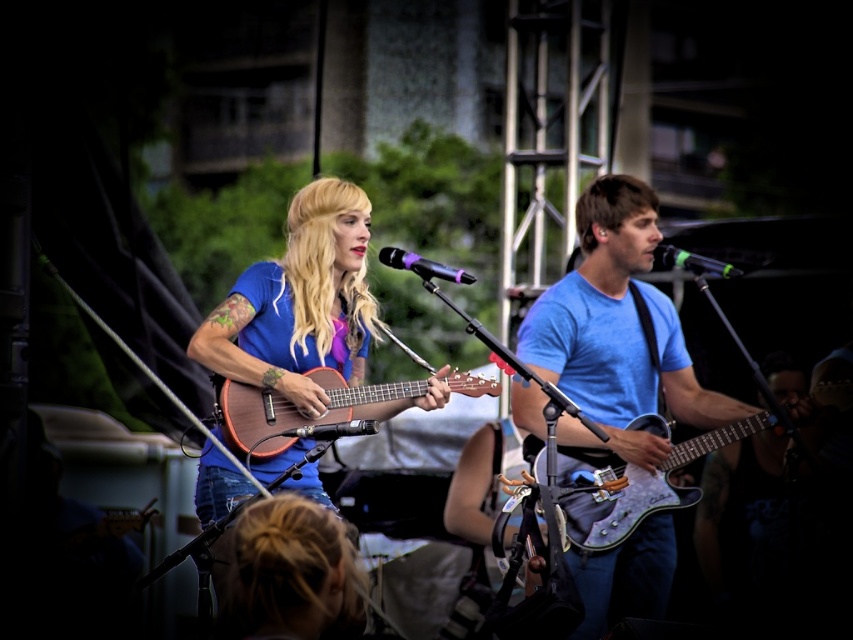
How distant is white glossy electric guitar at center from metallic silver microphone at center?

white glossy electric guitar at center is 3.59 feet from metallic silver microphone at center.

Which is above, white glossy electric guitar at center or metallic silver microphone at center?

metallic silver microphone at center is higher up.

Who is more forward, (631,467) or (308,429)?

Positioned in front is point (308,429).

You are a GUI agent. You are given a task and a screenshot of the screen. Output one action in this format:
    pyautogui.click(x=<x>, y=<y>)
    Task: Click on the white glossy electric guitar at center
    
    Given the screenshot: What is the action you would take?
    pyautogui.click(x=637, y=486)

Who is positioned more to the right, matte blue guitar at right or black metallic microphone at center?

black metallic microphone at center is more to the right.

What do you see at coordinates (618, 330) in the screenshot? This screenshot has width=853, height=640. I see `matte blue guitar at right` at bounding box center [618, 330].

Which is in front, point (546, 317) or point (720, 266)?

Point (720, 266) is in front.

In order to click on matte blue guitar at right in this screenshot , I will do `click(618, 330)`.

Can you confirm if matte blue guitar at right is wider than wooden acoustic guitar at center?

In fact, matte blue guitar at right might be narrower than wooden acoustic guitar at center.

Can you confirm if matte blue guitar at right is bigger than wooden acoustic guitar at center?

Correct, matte blue guitar at right is larger in size than wooden acoustic guitar at center.

Is point (590, 260) positioned in front of point (329, 387)?

That is False.

Where is `matte blue guitar at right`? The image size is (853, 640). matte blue guitar at right is located at coordinates (618, 330).